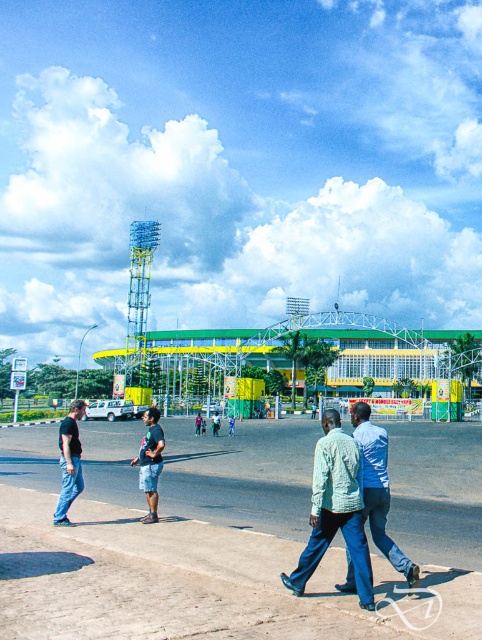
Question: Which of the following is the farthest from the observer?

Choices:
 (A) (62, 524)
 (B) (348, 442)

Answer: (A)

Question: Among these objects, which one is farthest from the camera?

Choices:
 (A) light blue denim pants at center
 (B) dark blue jeans at left
 (C) light green fabric jacket at center

Answer: (B)

Question: Can you confirm if light green fabric jacket at center is bigger than dark blue jeans at left?

Choices:
 (A) yes
 (B) no

Answer: (B)

Question: In this image, where is light green fabric jacket at center located relative to dark blue jeans at center?

Choices:
 (A) right
 (B) left

Answer: (A)

Question: Estimate the real-world distances between objects in this image. Which object is closer to the light green fabric jacket at center?

Choices:
 (A) dark blue jeans at left
 (B) dark blue jeans at center
 (C) light blue denim pants at center

Answer: (C)

Question: Can you confirm if light blue denim pants at center is bigger than dark blue jeans at center?

Choices:
 (A) no
 (B) yes

Answer: (A)